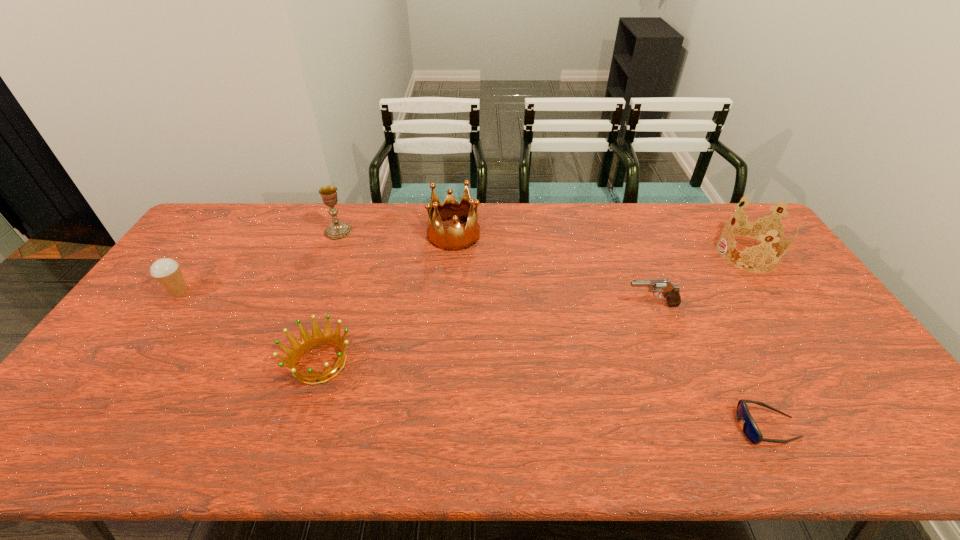
This screenshot has height=540, width=960. Find the location of `the shortest object`. the shortest object is located at coordinates (750, 429).

The image size is (960, 540). In order to click on vacant space located 0.090m on the left of the fourth object from left to right in this screenshot , I will do `click(402, 234)`.

Where is `vacant area situated 0.090m on the back of the chalice`? vacant area situated 0.090m on the back of the chalice is located at coordinates (347, 209).

You are a GUI agent. You are given a task and a screenshot of the screen. Output one action in this format:
    pyautogui.click(x=<x>, y=<y>)
    Task: Click on the free spot located on the left of the rightmost object
    The height and width of the screenshot is (540, 960).
    Given the screenshot: What is the action you would take?
    pyautogui.click(x=616, y=253)

This screenshot has height=540, width=960. Find the location of `free region located 0.100m on the right of the icecream`. free region located 0.100m on the right of the icecream is located at coordinates (225, 292).

The height and width of the screenshot is (540, 960). I want to click on vacant area situated 0.360m at the barrel of the third object from right to left, so click(503, 305).

Identify the location of vacant space located at the barrel of the third object from right to left. Image resolution: width=960 pixels, height=540 pixels. (503, 305).

Locate an element on the screen. This screenshot has width=960, height=540. vacant area situated 0.290m at the barrel of the third object from right to left is located at coordinates (527, 305).

Locate an element on the screen. vacant space located 0.190m on the right of the shortest crown is located at coordinates (427, 363).

The height and width of the screenshot is (540, 960). I want to click on vacant region located on the front-facing side of the sixth object from left to right, so click(x=625, y=427).